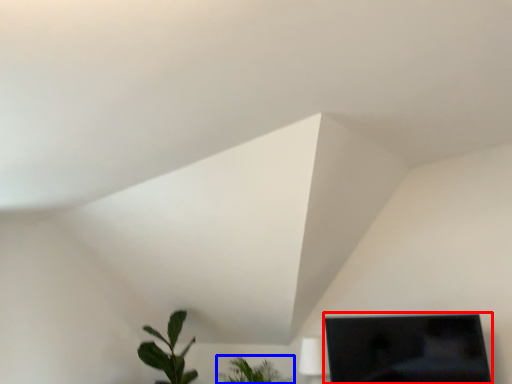
Question: Among these objects, which one is farthest to the camera, computer monitor (highlighted by a red box) or houseplant (highlighted by a blue box)?

Choices:
 (A) computer monitor
 (B) houseplant

Answer: (B)